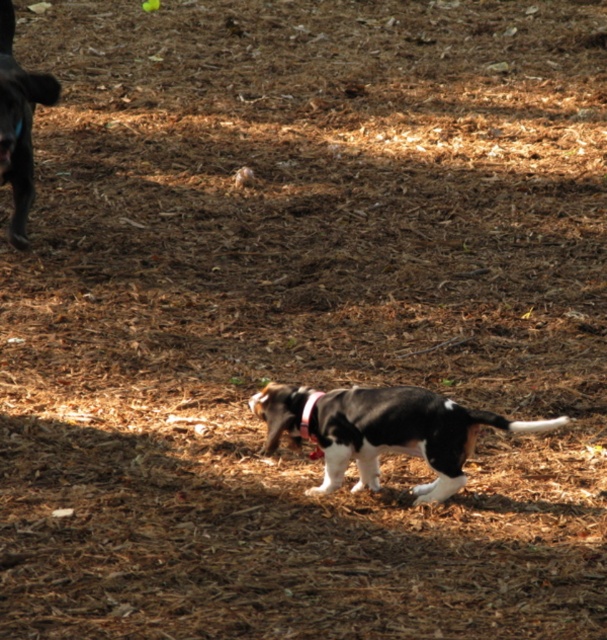
Based on the image, what are the coordinates of the black and white fur dog at center?

The coordinates of the black and white fur dog at center are at point (401,435).

Based on the coordinates provided, where is the black and white fur dog at center located in the image?

The black and white fur dog at center is located at coordinates point (401, 435).

You are a photographer trying to capture a clear shot of the black and white fur dog at center. However, the black fabric neckband at center is blocking part of the dog. Can you adjust your camera angle to avoid the neckband while still keeping the dog in the frame?

The black and white fur dog at center is located above the black fabric neckband at center, so tilting the camera slightly upward or moving it to a higher angle should allow you to capture the dog without the neckband obstructing the view.